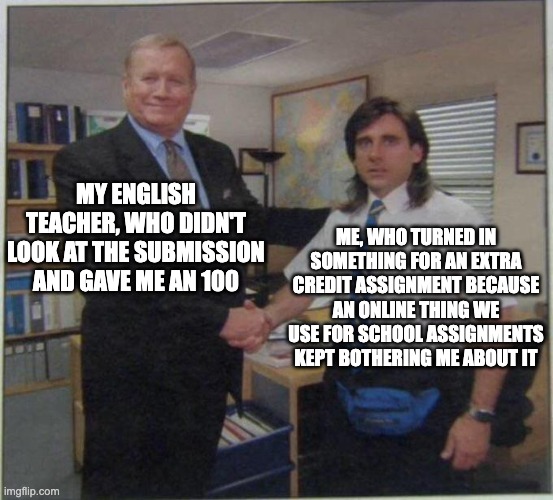
Where is `floor lamp`? floor lamp is located at coordinates (270, 158).